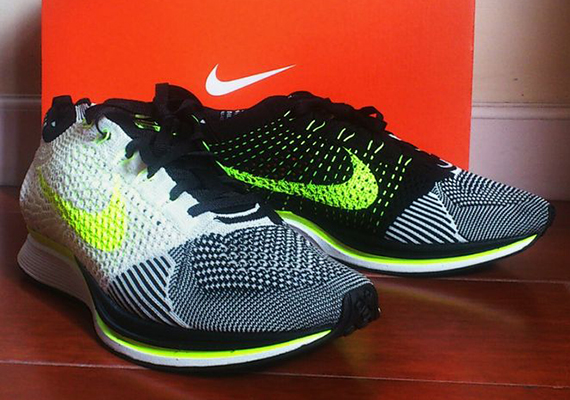
Image resolution: width=570 pixels, height=400 pixels. What are the coordinates of `top of shoe box` in the screenshot? It's located at (420, 88).